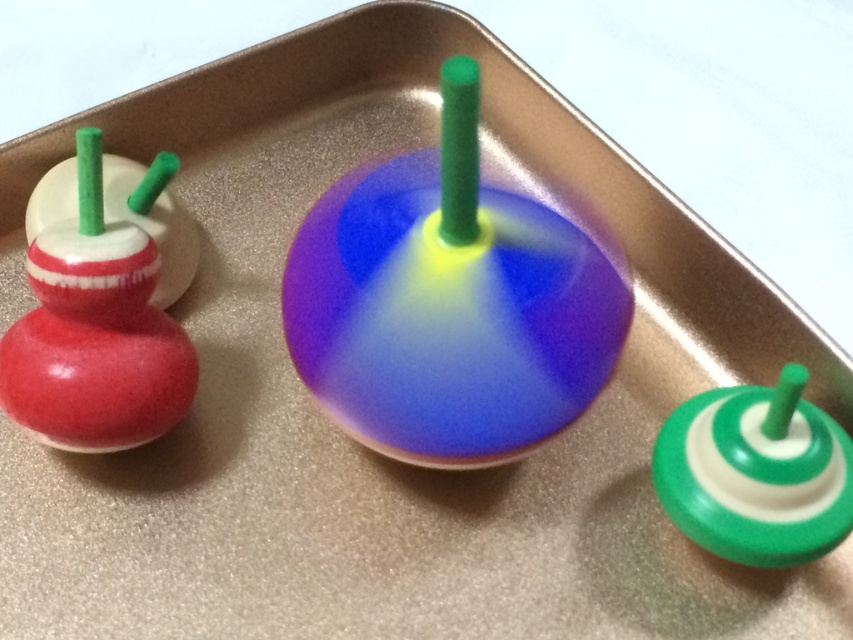
Question: Which point appears farthest from the camera in this image?

Choices:
 (A) (744, 556)
 (B) (376, 369)

Answer: (A)

Question: Considering the real-world distances, which object is closest to the shiny plastic spinning top at center?

Choices:
 (A) matte red wooden toy at left
 (B) green rubber spinner at lower right

Answer: (B)

Question: Is matte red wooden toy at left bigger than green rubber spinner at lower right?

Choices:
 (A) yes
 (B) no

Answer: (A)

Question: Estimate the real-world distances between objects in this image. Which object is closer to the matte red wooden toy at left?

Choices:
 (A) green rubber spinner at lower right
 (B) shiny plastic spinning top at center

Answer: (B)

Question: Is shiny plastic spinning top at center bigger than matte red wooden toy at left?

Choices:
 (A) yes
 (B) no

Answer: (A)

Question: Considering the relative positions of shiny plastic spinning top at center and matte red wooden toy at left in the image provided, where is shiny plastic spinning top at center located with respect to matte red wooden toy at left?

Choices:
 (A) left
 (B) right

Answer: (B)